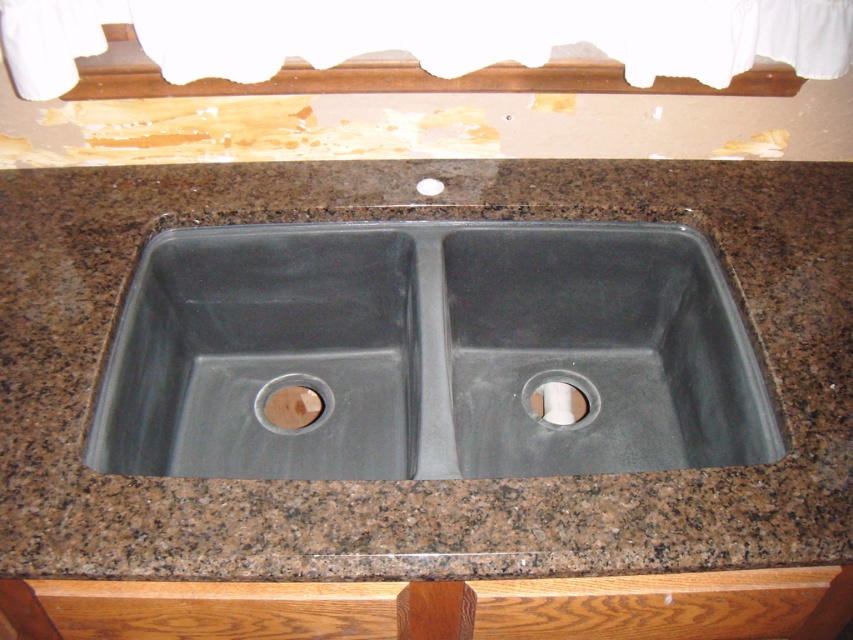
You are standing in front of the kitchen sink area and want to reach two points marked on the wall. The first point is at coordinate point (735, 458) and the second is at coordinate point (306, 428). Which point will you need to stretch your arm less to reach?

Point (735, 458) is closer to you than point (306, 428), so you will need to stretch your arm less to reach point (735, 458).

You are a painter standing in front of the kitchen sink area. You need to touch both the point at coordinates point (525, 385) and point (328, 417) on the wall. Which point should you reach for first to minimize the distance you walk?

You should reach for point (525, 385) first because it is closer to you than point (328, 417), so touching it first reduces the total distance walked.